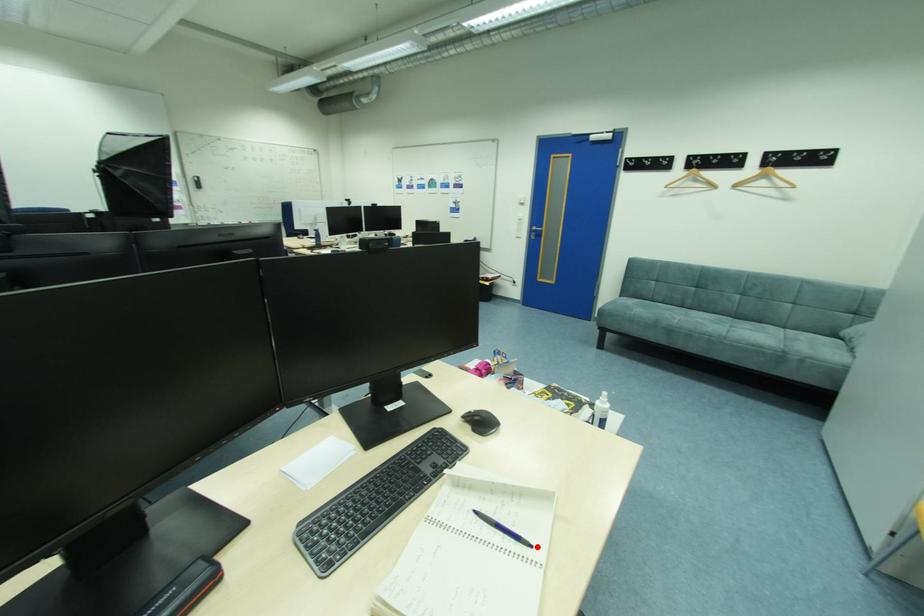
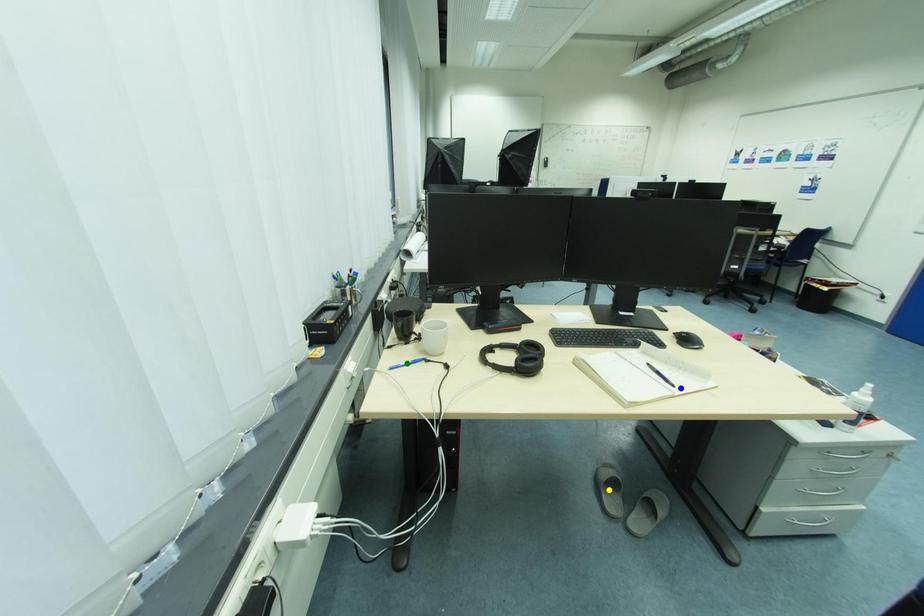
Question: I am providing you with two images of the same scene from different viewpoints. A red point is marked on the first image. You are given multiple points on the second image. Which point in image 2 represents the same 3d spot as the red point in image 1?

Choices:
 (A) yellow point
 (B) blue point
 (C) green point

Answer: (B)